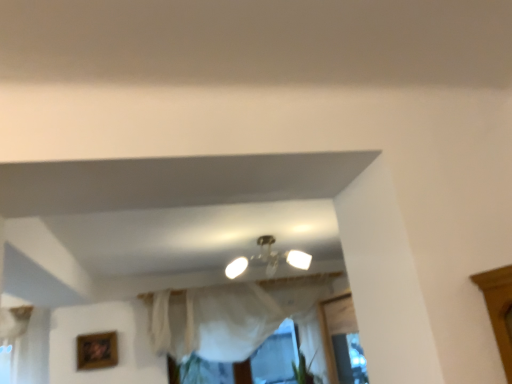
Looking at this image, what is the approximate width of white sheer curtain at center?

white sheer curtain at center is 11.20 inches wide.

I want to click on green leafy plant at lower center, so click(304, 370).

Can you confirm if matte white ceiling light at center is wider than green leafy plant at lower center?

Yes.

At what (x,y) coordinates should I click in order to perform the action: click on lamp on the left of green leafy plant at lower center. Please return your answer as a coordinate pair (x, y). Looking at the image, I should click on (280, 256).

Based on the photo, is matte white ceiling light at center far from green leafy plant at lower center?

Yes.

Is matte white ceiling light at center in front of or behind green leafy plant at lower center in the image?

Visually, matte white ceiling light at center is located in front of green leafy plant at lower center.

From the image's perspective, is white sheer curtain at center positioned above or below wooden picture frame at lower left?

From the image's perspective, white sheer curtain at center appears above wooden picture frame at lower left.

How distant is white sheer curtain at center from wooden picture frame at lower left?

38.94 inches.

Does white sheer curtain at center come in front of wooden picture frame at lower left?

Yes, white sheer curtain at center is closer to the viewer.

Can you tell me how much white sheer curtain at center and wooden picture frame at lower left differ in facing direction?

4.51 degrees.

From the image's perspective, is matte white ceiling light at center located beneath wooden picture frame at lower left?

No, from the image's perspective, matte white ceiling light at center is not beneath wooden picture frame at lower left.

From the picture: Is matte white ceiling light at center completely or partially outside of wooden picture frame at lower left?

matte white ceiling light at center lies outside wooden picture frame at lower left's area.

Considering the relative sizes of matte white ceiling light at center and wooden picture frame at lower left in the image provided, is matte white ceiling light at center smaller than wooden picture frame at lower left?

No, matte white ceiling light at center is not smaller than wooden picture frame at lower left.

Does green leafy plant at lower center turn towards wooden picture frame at lower left?

No.

Is green leafy plant at lower center positioned beyond the bounds of wooden picture frame at lower left?

Yes, green leafy plant at lower center is located beyond the bounds of wooden picture frame at lower left.

Is there a large distance between green leafy plant at lower center and wooden picture frame at lower left?

green leafy plant at lower center is positioned a significant distance from wooden picture frame at lower left.

Considering the positions of points (298, 382) and (109, 352), is point (298, 382) farther from camera compared to point (109, 352)?

Yes.

From the image's perspective, relative to matte white ceiling light at center, is green leafy plant at lower center above or below?

Based on their image positions, green leafy plant at lower center is located beneath matte white ceiling light at center.

In the scene shown: In terms of size, does green leafy plant at lower center appear bigger or smaller than matte white ceiling light at center?

In the image, green leafy plant at lower center appears to be smaller than matte white ceiling light at center.

How many degrees apart are the facing directions of green leafy plant at lower center and matte white ceiling light at center?

green leafy plant at lower center and matte white ceiling light at center are facing 1.15 degrees away from each other.

Is white sheer curtain at center completely or partially inside wooden picture frame at lower left?

No, white sheer curtain at center is not a part of wooden picture frame at lower left.

What are the coordinates of `curtain below the wooden picture frame at lower left (from a real-world perspective)` in the screenshot? It's located at (229, 315).

Is wooden picture frame at lower left in front of white sheer curtain at center?

No, wooden picture frame at lower left is further to the viewer.

How distant is wooden picture frame at lower left from white sheer curtain at center?

wooden picture frame at lower left is 98.91 centimeters away from white sheer curtain at center.

Is there a large distance between green leafy plant at lower center and white sheer curtain at center?

green leafy plant at lower center is near white sheer curtain at center, not far away.

Looking at the image, does green leafy plant at lower center seem bigger or smaller compared to white sheer curtain at center?

Considering their sizes, green leafy plant at lower center takes up less space than white sheer curtain at center.

I want to click on plant on the right of the matte white ceiling light at center, so click(304, 370).

The image size is (512, 384). Identify the location of picture frame behind the white sheer curtain at center. (97, 350).

Considering their positions, is green leafy plant at lower center positioned further to matte white ceiling light at center than wooden picture frame at lower left?

wooden picture frame at lower left is positioned further to the anchor matte white ceiling light at center.

Considering their positions, is green leafy plant at lower center positioned closer to wooden picture frame at lower left than matte white ceiling light at center?

matte white ceiling light at center is closer to wooden picture frame at lower left.

Looking at the image, which one is located further to wooden picture frame at lower left, white sheer curtain at center or matte white ceiling light at center?

matte white ceiling light at center.

Looking at this image, from the image, which object appears to be farther from wooden picture frame at lower left, matte white ceiling light at center or green leafy plant at lower center?

Among the two, green leafy plant at lower center is located further to wooden picture frame at lower left.

Estimate the real-world distances between objects in this image. Which object is closer to white sheer curtain at center, green leafy plant at lower center or matte white ceiling light at center?

matte white ceiling light at center.

Looking at the image, which one is located closer to matte white ceiling light at center, green leafy plant at lower center or white sheer curtain at center?

Among the two, white sheer curtain at center is located nearer to matte white ceiling light at center.

Based on their spatial positions, is matte white ceiling light at center or white sheer curtain at center closer to wooden picture frame at lower left?

Based on the image, white sheer curtain at center appears to be nearer to wooden picture frame at lower left.

Estimate the real-world distances between objects in this image. Which object is further from green leafy plant at lower center, white sheer curtain at center or matte white ceiling light at center?

matte white ceiling light at center is further to green leafy plant at lower center.

Where is `curtain between matte white ceiling light at center and green leafy plant at lower center from top to bottom`? The width and height of the screenshot is (512, 384). curtain between matte white ceiling light at center and green leafy plant at lower center from top to bottom is located at coordinates (229, 315).

Image resolution: width=512 pixels, height=384 pixels. In order to click on curtain located between wooden picture frame at lower left and green leafy plant at lower center in the left-right direction in this screenshot , I will do `click(229, 315)`.

Identify the location of curtain between wooden picture frame at lower left and matte white ceiling light at center. (229, 315).

Locate an element on the screen. Image resolution: width=512 pixels, height=384 pixels. lamp situated between wooden picture frame at lower left and green leafy plant at lower center from left to right is located at coordinates (280, 256).